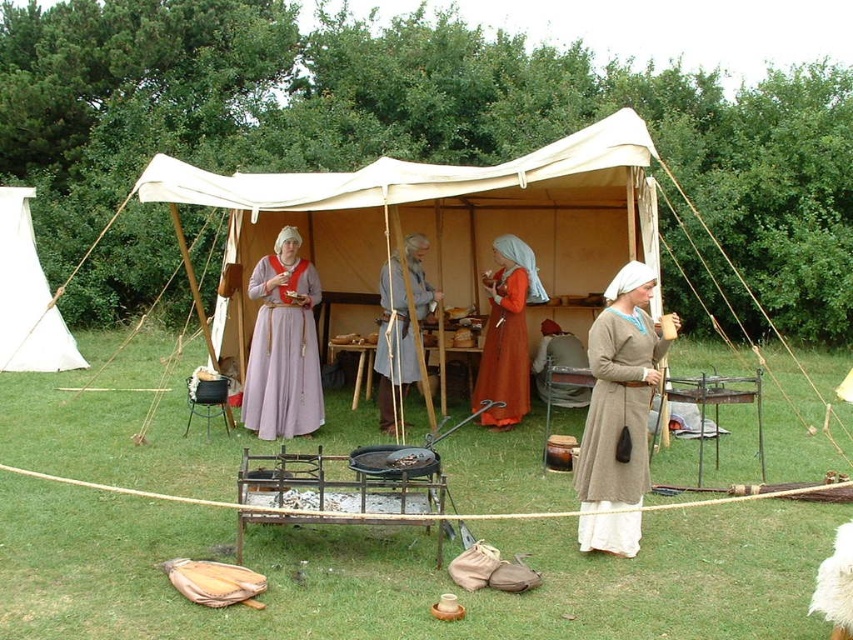
You are a visitor at the historical reenactment and want to take a photo of both the matte purple gown at center and the white canvas tent at left. Can you see both objects in the same frame without moving your camera?

Yes, the matte purple gown at center is in front of the white canvas tent at left, so they are positioned in a way that both can be captured in the same frame without moving the camera.

You are a visitor at the historical reenactment and want to take a photo of both the brown woolen dress at center and the matte purple gown at center. Which one should you focus on first to ensure both are in the frame?

You should focus on the brown woolen dress at center first because it is closer to the viewer than the matte purple gown at center, ensuring both will be in the frame when properly focused.